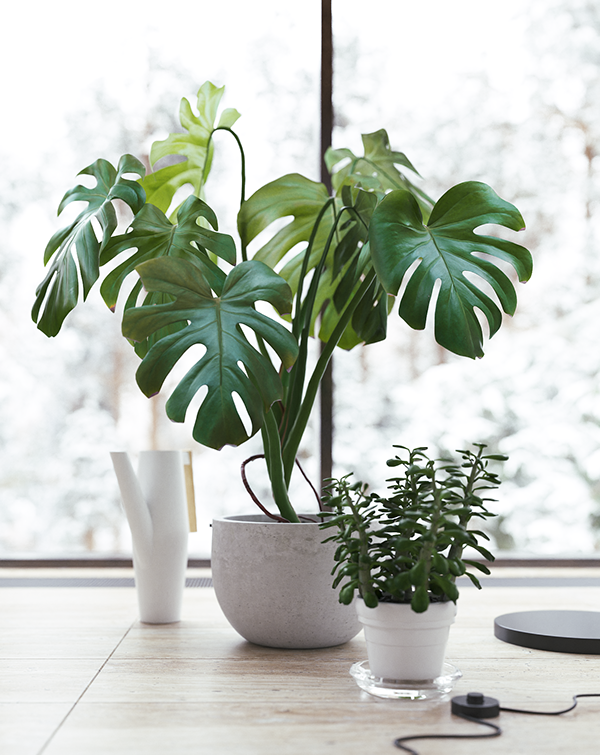
Where is `black cord`? The image size is (600, 755). black cord is located at coordinates (490, 735).